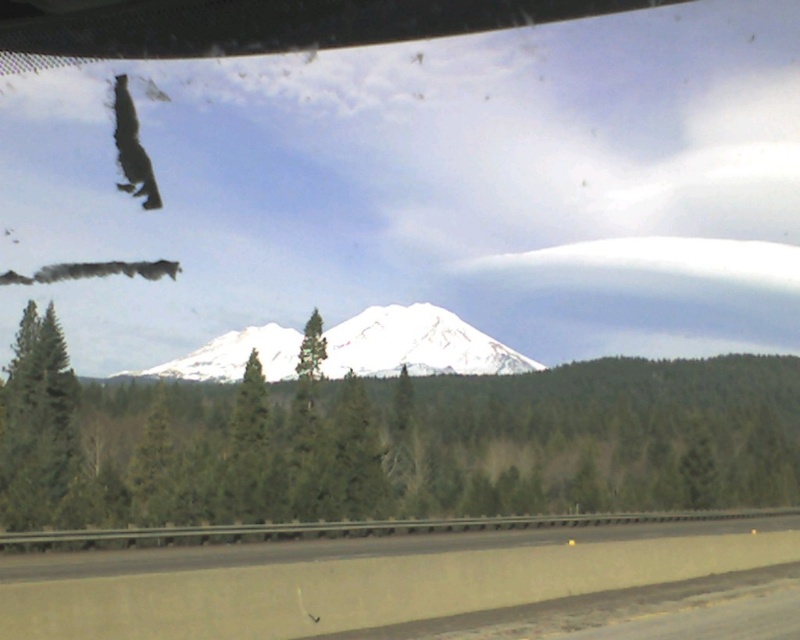
Does white snow-covered mountain at center have a smaller size compared to green matte tree at left?

Incorrect, white snow-covered mountain at center is not smaller in size than green matte tree at left.

Is white snow-covered mountain at center wider than green matte tree at left?

Correct, the width of white snow-covered mountain at center exceeds that of green matte tree at left.

Which is in front, point (172, 378) or point (20, 428)?

Positioned in front is point (20, 428).

At what (x,y) coordinates should I click in order to perform the action: click on white snow-covered mountain at center. Please return your answer as a coordinate pair (x, y). Looking at the image, I should click on (416, 344).

Between point (28, 513) and point (12, 392), which one is positioned in front?

Point (28, 513) is in front.

Between green matte tree at center and green matte tree at left, which one appears on the right side from the viewer's perspective?

green matte tree at center

Measure the distance between green matte tree at center and camera.

green matte tree at center and camera are 26.60 meters apart from each other.

Image resolution: width=800 pixels, height=640 pixels. I want to click on green matte tree at center, so click(389, 442).

Does green matte tree at center have a smaller size compared to white snow-covered mountain at center?

No.

Is green matte tree at center shorter than white snow-covered mountain at center?

In fact, green matte tree at center may be taller than white snow-covered mountain at center.

Find the location of `green matte tree at center`. green matte tree at center is located at coordinates (389, 442).